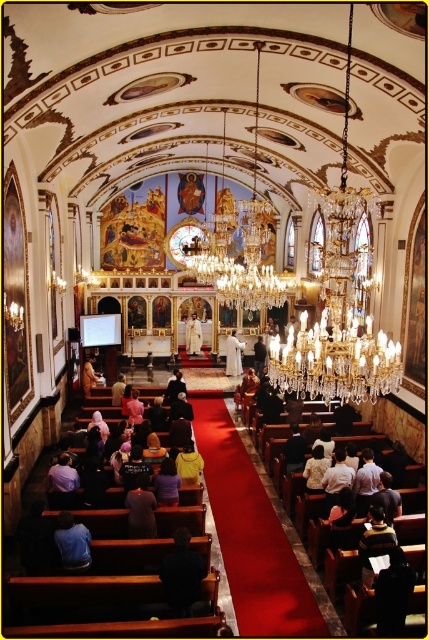
You are standing at the entrance of the church and notice two individuals at the center. One is labeled as the white clothed person at center and the other as the white clothed figure at center. Which of these two is closer to the altar?

The white clothed person at center is smaller in size compared to the white clothed figure at center. Since size can indicate distance, the smaller white clothed person at center is likely closer to the altar.

You are a maintenance worker in the church and need to move a 60 feet long pipe from the blue shirt at lower left to the wooden chair at lower left. Can you move it without bending the pipe?

The distance between the blue shirt at lower left and the wooden chair at lower left is 57.53 feet, which is shorter than the pipe length of 60 feet. Therefore, the pipe cannot be moved straight without bending it.